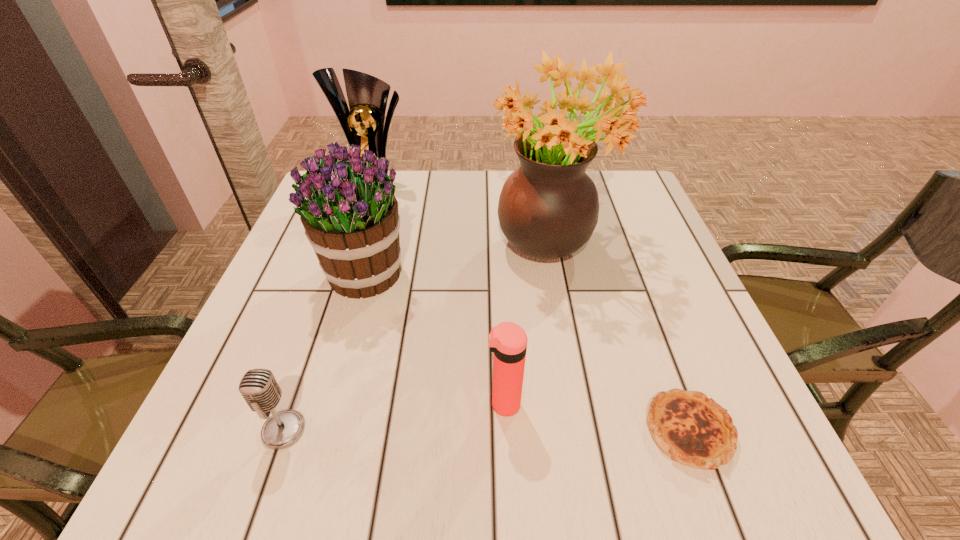
Locate an element on the screen. This screenshot has width=960, height=540. vacant region at the near right corner of the desktop is located at coordinates (757, 433).

At what (x,y) coordinates should I click in order to perform the action: click on free spot between the tallest object and the microphone. Please return your answer as a coordinate pair (x, y). Looking at the image, I should click on (417, 336).

Find the location of a particular element. The width and height of the screenshot is (960, 540). vacant region between the second shortest object and the bouquet is located at coordinates (324, 351).

Image resolution: width=960 pixels, height=540 pixels. I want to click on vacant point located between the microphone and the fourth tallest object, so click(394, 417).

Locate an element on the screen. empty space between the thermos bottle and the tallest object is located at coordinates (527, 323).

Locate an element on the screen. free area in between the flower arrangement and the third shortest object is located at coordinates (527, 323).

You are a GUI agent. You are given a task and a screenshot of the screen. Output one action in this format:
    pyautogui.click(x=<x>, y=<y>)
    Task: Click on the free space between the award and the microphone
    The height and width of the screenshot is (540, 960).
    Given the screenshot: What is the action you would take?
    pyautogui.click(x=330, y=308)

The height and width of the screenshot is (540, 960). In order to click on vacant area that lies between the shortest object and the farthest object in this screenshot , I will do `click(533, 309)`.

Where is `vacant area that lies between the farthest object and the shortest object`? The height and width of the screenshot is (540, 960). vacant area that lies between the farthest object and the shortest object is located at coordinates (533, 309).

The height and width of the screenshot is (540, 960). Identify the location of vacant area that lies between the flower arrangement and the shortest object. (619, 336).